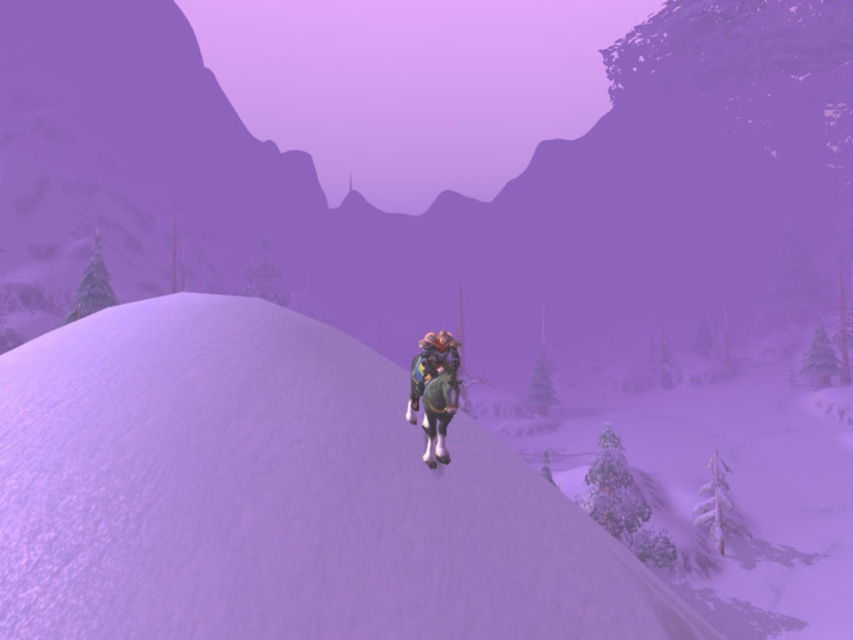
You are standing at the point marked by the coordinates point [444,193] in the snowy landscape. Looking around, you see the rider and their horse. In which direction relative to your position would you find the rider and their horse?

The rider and their horse are located at the foreground slope covered in snow, which is in front of the point [444,193]. Since the point [444,193] represents the white matte snow at center, the rider and their horse are positioned in the foreground, meaning they are in front of your current position marked by the coordinates point [444,193].

You are standing in the snowy landscape and see two points marked in the image. The first point is at coordinates point (802, 154) and the second is at point (248, 497). Which point is closer to you?

Point (802, 154) is further to the camera than point (248, 497), so the point closer to you is point (248, 497).